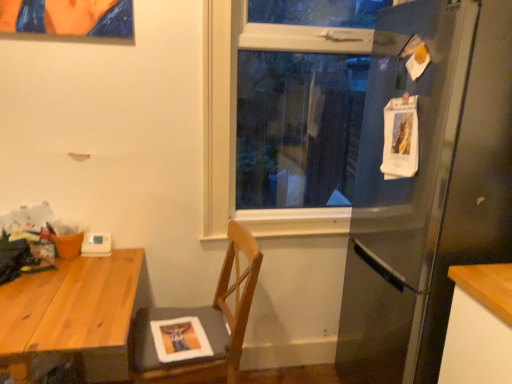
Question: Considering the positions of wooden chair at center and clear glass window at center in the image, is wooden chair at center wider or thinner than clear glass window at center?

Choices:
 (A) thin
 (B) wide

Answer: (B)

Question: Considering the positions of wooden chair at center and clear glass window at center in the image, is wooden chair at center taller or shorter than clear glass window at center?

Choices:
 (A) short
 (B) tall

Answer: (A)

Question: Which object is positioned farthest from the wooden chair at center?

Choices:
 (A) clear glass window at center
 (B) satin silver refrigerator at right
 (C) white plastic thermostat at upper left
 (D) wooden desk at left

Answer: (B)

Question: Which object is the closest to the satin silver refrigerator at right?

Choices:
 (A) wooden chair at center
 (B) clear glass window at center
 (C) wooden desk at left
 (D) white plastic thermostat at upper left

Answer: (B)